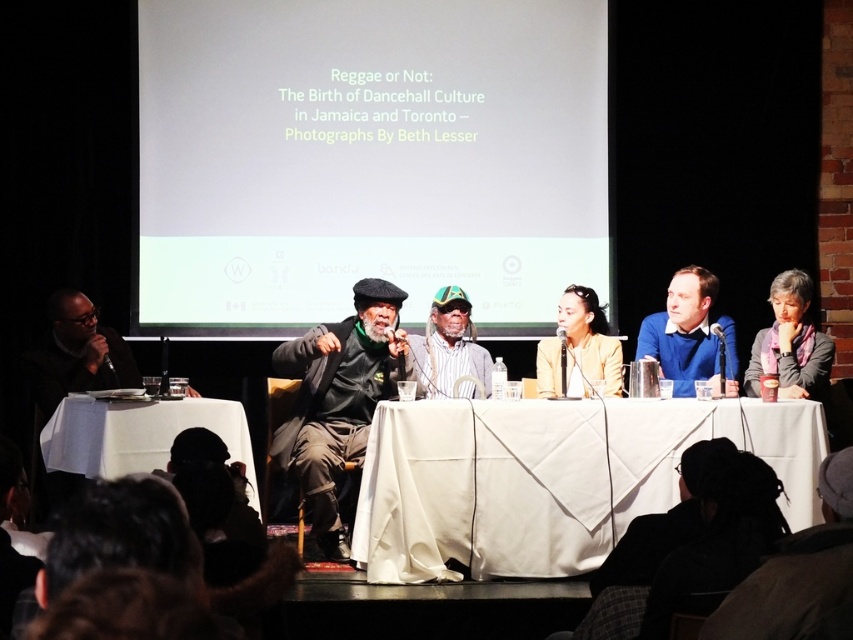
You are an event organizer who needs to ensure that all participants have enough space to move their arms comfortably during the discussion. Given that the table is 1.2 meters wide, and the space between the two center objects is 0.8 meters, can both the matte yellow blazer at center and the striped fabric hat at center be positioned such that they do not interfere with each other?

The matte yellow blazer at center is wider than the striped fabric hat at center. Since the space between them is 0.8 meters, which is less than the combined width of both items, they might interfere with each other during arm movements. The organizer should consider rearranging the table setup to provide more space between the matte yellow blazer at center and the striped fabric hat at center.

You are sitting in the audience and want to take a photo of the blue sweater at center and the white matte screen at upper center. Which object will appear larger in your photo?

The white matte screen at upper center will appear larger in the photo because it is closer to the viewer than the blue sweater at center.